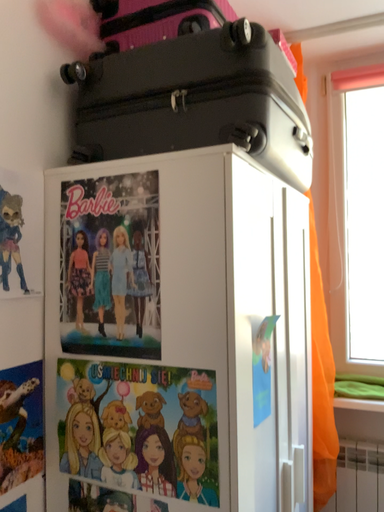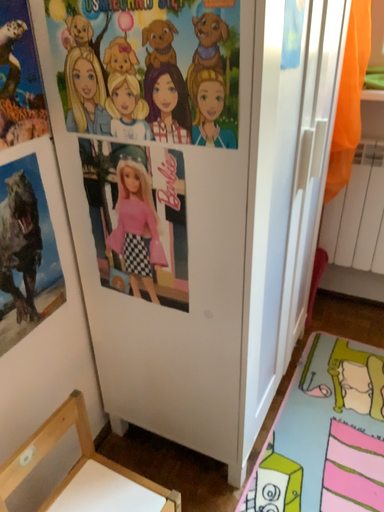
Question: How did the camera likely rotate when shooting the video?

Choices:
 (A) rotated upward
 (B) rotated downward

Answer: (B)